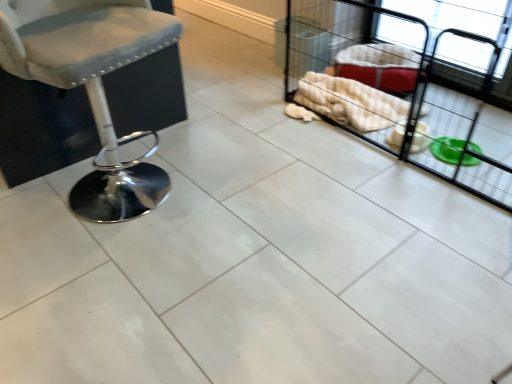
Question: Should I look upward or downward to see white fabric baby carriage at right?

Choices:
 (A) up
 (B) down

Answer: (A)

Question: Is the position of matte gray fabric stool at left more distant than that of white fabric baby carriage at right?

Choices:
 (A) no
 (B) yes

Answer: (A)

Question: Considering the relative sizes of matte gray fabric stool at left and white fabric baby carriage at right in the image provided, is matte gray fabric stool at left shorter than white fabric baby carriage at right?

Choices:
 (A) no
 (B) yes

Answer: (A)

Question: Is matte gray fabric stool at left smaller than white fabric baby carriage at right?

Choices:
 (A) no
 (B) yes

Answer: (B)

Question: Is matte gray fabric stool at left to the right of white fabric baby carriage at right from the viewer's perspective?

Choices:
 (A) no
 (B) yes

Answer: (A)

Question: From the image's perspective, is matte gray fabric stool at left located above white fabric baby carriage at right?

Choices:
 (A) yes
 (B) no

Answer: (B)

Question: Is matte gray fabric stool at left in contact with white fabric baby carriage at right?

Choices:
 (A) yes
 (B) no

Answer: (B)

Question: Is white fabric baby carriage at right facing away from matte gray fabric stool at left?

Choices:
 (A) yes
 (B) no

Answer: (B)

Question: Is there a large distance between white fabric baby carriage at right and matte gray fabric stool at left?

Choices:
 (A) yes
 (B) no

Answer: (A)

Question: Are white fabric baby carriage at right and matte gray fabric stool at left beside each other?

Choices:
 (A) yes
 (B) no

Answer: (B)

Question: Does white fabric baby carriage at right have a lesser width compared to matte gray fabric stool at left?

Choices:
 (A) no
 (B) yes

Answer: (A)

Question: Does white fabric baby carriage at right come behind matte gray fabric stool at left?

Choices:
 (A) yes
 (B) no

Answer: (A)

Question: Is white fabric baby carriage at right wider than matte gray fabric stool at left?

Choices:
 (A) yes
 (B) no

Answer: (A)

Question: From the image's perspective, is matte gray fabric stool at left above or below white fabric baby carriage at right?

Choices:
 (A) below
 (B) above

Answer: (A)